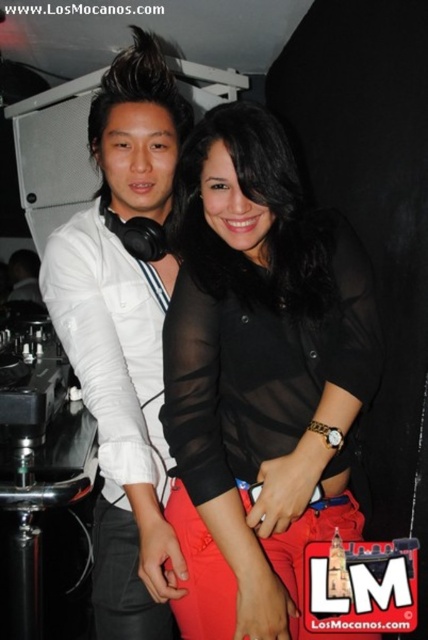
You are a photographer at the event and want to capture a photo where the sheer black blouse at center is clearly visible without being blocked by the white matte shirt at left. Based on their positions, is this possible?

The sheer black blouse at center is in front of the white matte shirt at left, so it is already positioned in a way that it isn not blocked. Therefore, the photographer can capture the sheer black blouse at center clearly without obstruction.

You are at point (x=148, y=141) and want to move to the DJ booth located at point (x=195, y=384). Is the path directly between these two points clear of obstacles?

Yes, the path between point (x=148, y=141) and point (x=195, y=384) is clear since point (x=195, y=384) is in front of point (x=148, y=141), indicating no obstacles are blocking the direct route.

You are a photographer standing 1.2 meters away from the DJ booth. You want to take a photo of the point at coordinates point (246,483). Can you reach the point with your current position?

The distance of point (246,483) from the camera is 1.13 meters. Since you are standing 1.2 meters away from the DJ booth, you are slightly farther than the point, so you can still take the photo as the distance is close enough.